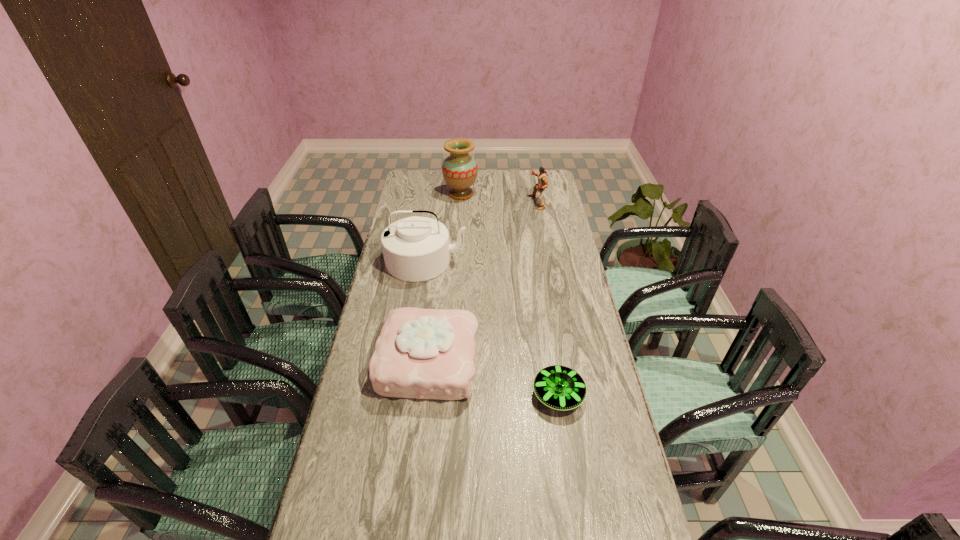
Where is `vacant region that satisfies the following two spatial constraints: 1. on the spout of the cake; 2. on the right side of the third nearest object`? vacant region that satisfies the following two spatial constraints: 1. on the spout of the cake; 2. on the right side of the third nearest object is located at coordinates (411, 361).

Find the location of `free point that satisfies the following two spatial constraints: 1. on the spout of the third farthest object; 2. on the left side of the cake`. free point that satisfies the following two spatial constraints: 1. on the spout of the third farthest object; 2. on the left side of the cake is located at coordinates (411, 361).